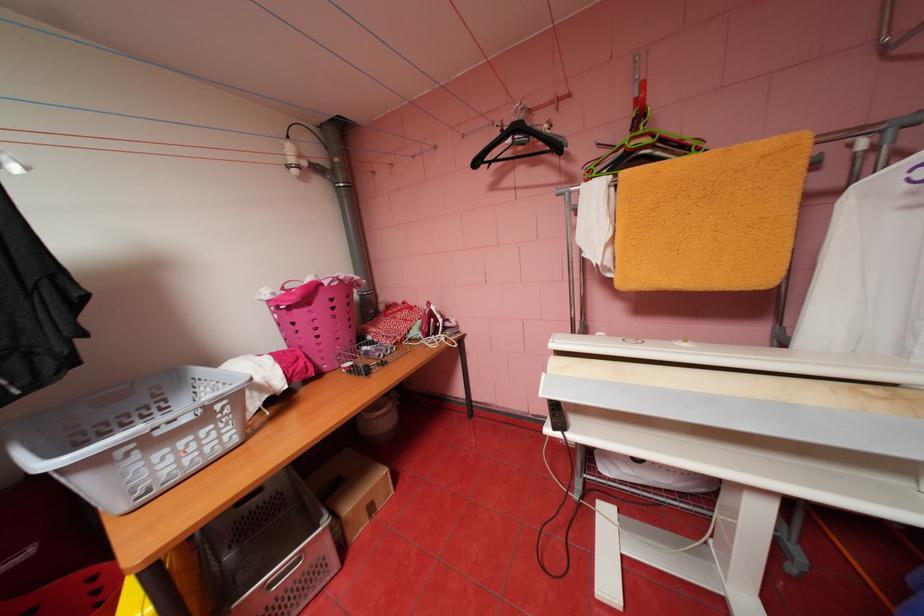
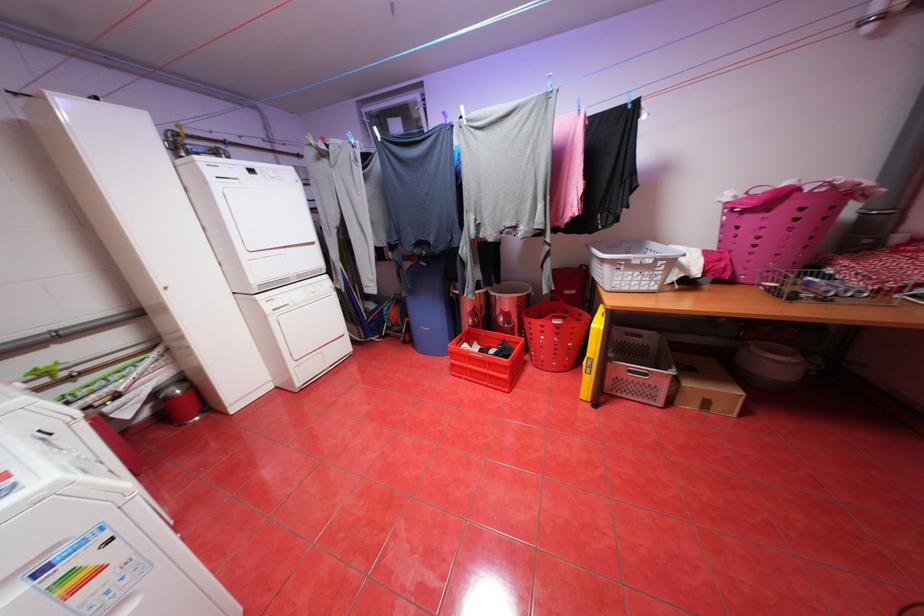
Locate, in the second image, the point that corresponds to [334,522] in the first image.

(681, 371)